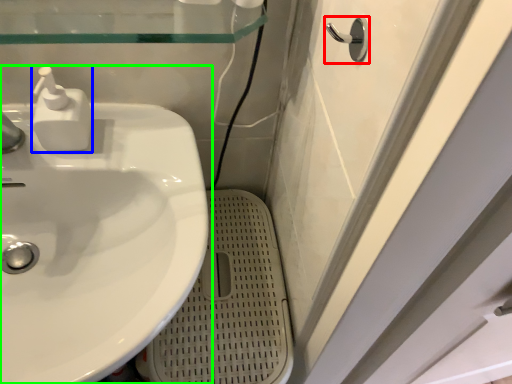
Question: Based on their relative distances, which object is nearer to door handle (highlighted by a red box)? Choose from soap dispenser (highlighted by a blue box) and sink (highlighted by a green box).

Choices:
 (A) soap dispenser
 (B) sink

Answer: (A)